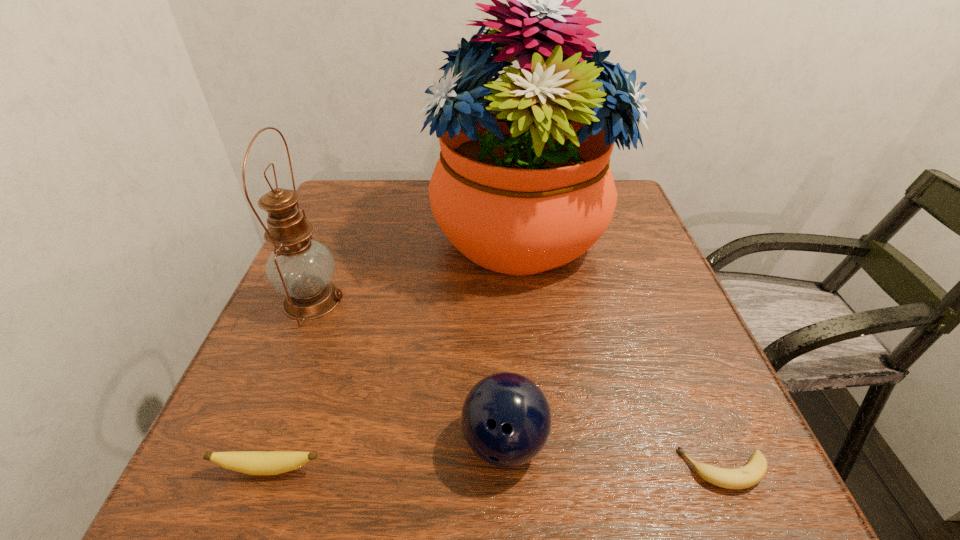
Locate an element on the screen. The height and width of the screenshot is (540, 960). free spot located at the stem of the shorter banana is located at coordinates (641, 470).

You are a GUI agent. You are given a task and a screenshot of the screen. Output one action in this format:
    pyautogui.click(x=<x>, y=<y>)
    Task: Click on the free location located 0.100m at the stem of the shorter banana
    Image resolution: width=960 pixels, height=540 pixels.
    Given the screenshot: What is the action you would take?
    pyautogui.click(x=614, y=470)

Where is `object positioned at the far edge`? Image resolution: width=960 pixels, height=540 pixels. object positioned at the far edge is located at coordinates (523, 185).

Identify the location of bowling ball that is at the near edge. The height and width of the screenshot is (540, 960). (506, 419).

At what (x,y) coordinates should I click in order to perform the action: click on oil lamp situated at the left edge. Please return your answer as a coordinate pair (x, y). Looking at the image, I should click on (300, 268).

What are the coordinates of `banana that is at the left edge` in the screenshot? It's located at (249, 462).

Where is `flower arrangement at the right edge`? flower arrangement at the right edge is located at coordinates (523, 185).

Find the location of a particular element. banana situated at the right edge is located at coordinates (753, 472).

This screenshot has height=540, width=960. In order to click on object that is at the near left corner in this screenshot , I will do `click(249, 462)`.

Image resolution: width=960 pixels, height=540 pixels. In order to click on object that is at the far right corner in this screenshot , I will do `click(523, 185)`.